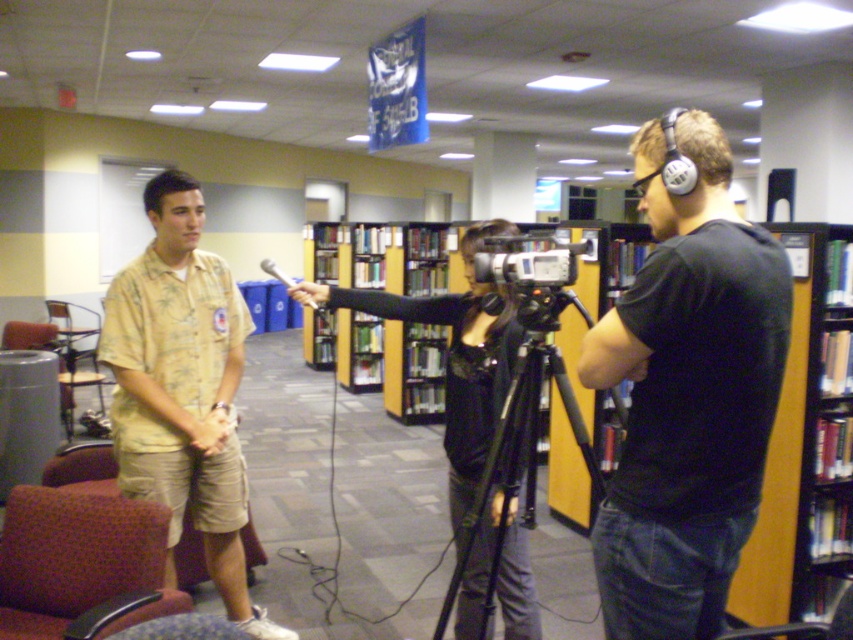
Question: Is velvet-like maroon swivel chair at lower left closer to the viewer compared to wooden bookcase at center?

Choices:
 (A) yes
 (B) no

Answer: (A)

Question: Among these objects, which one is farthest from the camera?

Choices:
 (A) light brown floral shirt at center
 (B) silver plastic video camera at center
 (C) silver metallic microphone at center

Answer: (C)

Question: Which of the following is the farthest from the observer?

Choices:
 (A) black matte headphones at right
 (B) yellow wood bookcase at center

Answer: (B)

Question: Where is yellow wood bookcase at center located in relation to silver metallic microphone at center in the image?

Choices:
 (A) above
 (B) below

Answer: (B)

Question: Is black matte headphones at right closer to the viewer compared to black matte tripod at center?

Choices:
 (A) no
 (B) yes

Answer: (B)

Question: Which of the following is the farthest from the observer?

Choices:
 (A) (38, 611)
 (B) (683, 108)
 (C) (445, 604)
 (D) (233, 461)

Answer: (B)